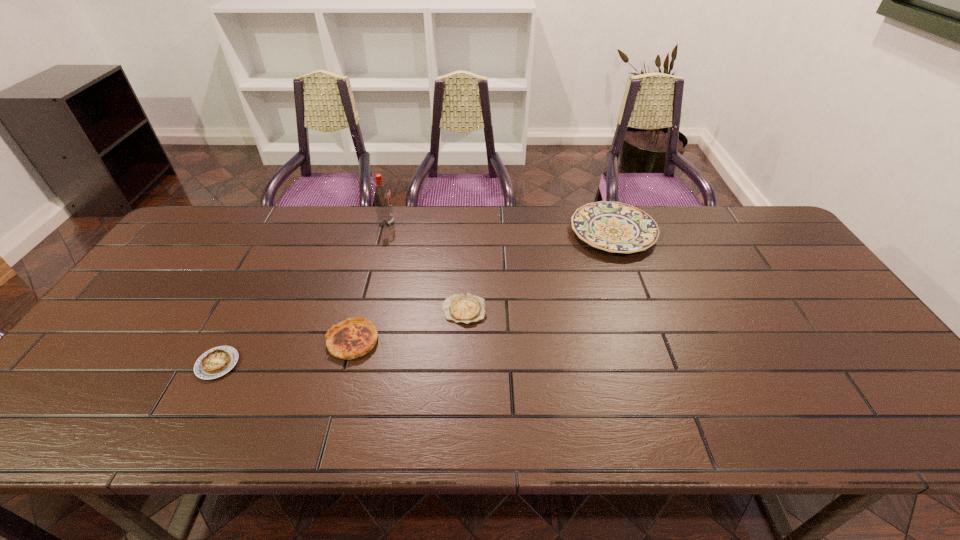
The image size is (960, 540). Identify the location of free space between the vodka and the shortest object. (425, 267).

The height and width of the screenshot is (540, 960). Find the location of `empty space between the rightmost object and the vodka`. empty space between the rightmost object and the vodka is located at coordinates (499, 228).

The image size is (960, 540). Find the location of `free space that is in between the rightmost object and the vodka`. free space that is in between the rightmost object and the vodka is located at coordinates (499, 228).

Where is `free space between the shortest quiche and the rightmost object`? The image size is (960, 540). free space between the shortest quiche and the rightmost object is located at coordinates (539, 272).

The height and width of the screenshot is (540, 960). Identify the location of free space between the tallest quiche and the rightmost quiche. (408, 326).

I want to click on vacant area that lies between the second shortest object and the second quiche from left to right, so click(285, 353).

The height and width of the screenshot is (540, 960). I want to click on free space between the tallest object and the second quiche from right to left, so click(x=370, y=282).

You are a GUI agent. You are given a task and a screenshot of the screen. Output one action in this format:
    pyautogui.click(x=<x>, y=<y>)
    Task: Click on the free area in between the rightmost object and the second quiche from left to right
    
    Given the screenshot: What is the action you would take?
    pyautogui.click(x=483, y=287)

Where is `blank region between the tallest quiche and the second shortest object`? Image resolution: width=960 pixels, height=540 pixels. blank region between the tallest quiche and the second shortest object is located at coordinates (285, 353).

Locate an element on the screen. The height and width of the screenshot is (540, 960). object that is the closest one to the plate is located at coordinates (466, 308).